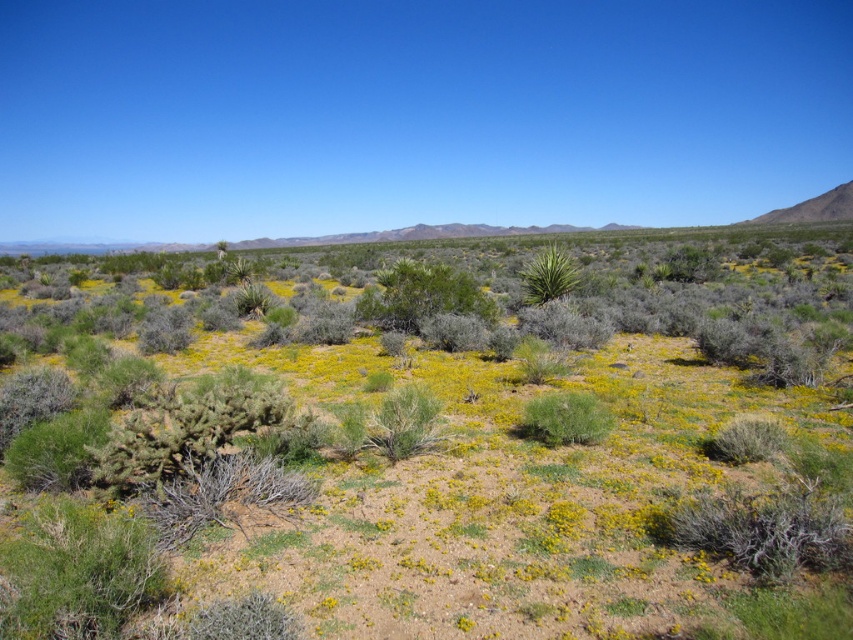
Is green leafy bush at center smaller than green spiky bush at center?

Yes.

At what (x,y) coordinates should I click in order to perform the action: click on green leafy bush at center. Please return your answer as a coordinate pair (x, y). Looking at the image, I should click on (421, 296).

This screenshot has width=853, height=640. I want to click on green leafy bush at center, so click(x=421, y=296).

Between green shrubs at center and green leafy bush at center, which one is positioned higher?

green leafy bush at center is higher up.

Does point (234, 356) come closer to viewer compared to point (403, 292)?

Yes, it is.

This screenshot has height=640, width=853. I want to click on green shrubs at center, so click(447, 461).

What do you see at coordinates (447, 461) in the screenshot? This screenshot has height=640, width=853. I see `green shrubs at center` at bounding box center [447, 461].

Which is more to the right, green shrubs at center or green spiky bush at center?

green spiky bush at center

Describe the element at coordinates (447, 461) in the screenshot. The height and width of the screenshot is (640, 853). I see `green shrubs at center` at that location.

This screenshot has height=640, width=853. I want to click on green shrubs at center, so click(447, 461).